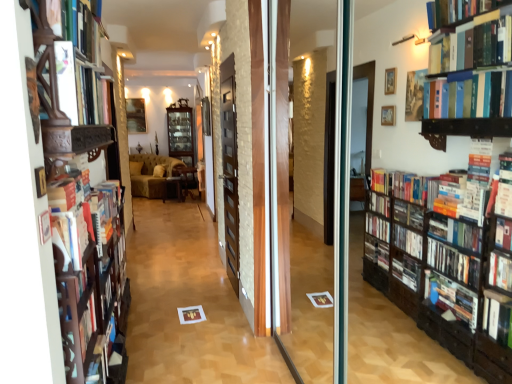
Question: In the image, is wooden side table at center, the 2th furniture when ordered from left to right, positioned in front of or behind velvet brown sofa at center, arranged as the first furniture when viewed from the left?

Choices:
 (A) behind
 (B) front

Answer: (B)

Question: Visually, is wooden side table at center, the 2th furniture when ordered from left to right, positioned to the left or to the right of velvet brown sofa at center, arranged as the first furniture when viewed from the left?

Choices:
 (A) left
 (B) right

Answer: (B)

Question: Which is nearer to the dark brown wooden screen door at center?

Choices:
 (A) velvet brown sofa at center, arranged as the first furniture when viewed from the left
 (B) wooden table at center, the third furniture positioned from the left
 (C) matte brown paper at center
 (D) wooden side table at center, the 2th furniture when ordered from left to right
 (E) matte white book at left, which is counted as the 2th book, starting from the top

Answer: (C)

Question: Considering the real-world distances, which object is closest to the wooden bookshelf at left?

Choices:
 (A) wooden table at center, which appears as the 1th furniture when viewed from the right
 (B) wooden side table at center, marked as the second furniture in a right-to-left arrangement
 (C) matte white book at upper left, which ranks as the 2th book in bottom-to-top order
 (D) matte brown paper at center
 (E) velvet brown sofa at center, the 3th furniture from the right

Answer: (C)